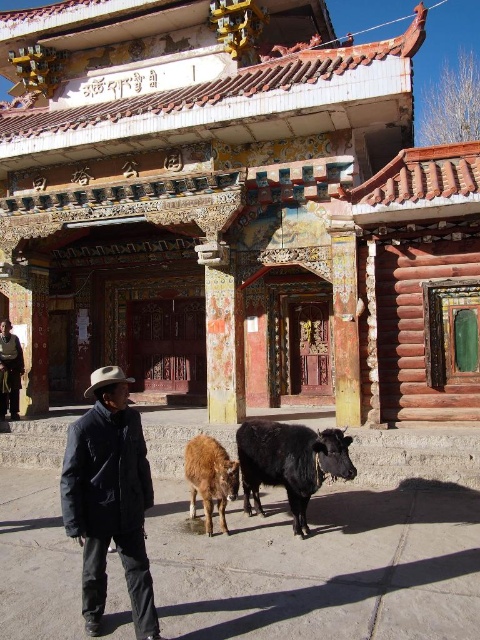
Can you confirm if dark brown leather jacket at left is bigger than white felt cowboy hat at center?

No.

Is dark brown leather jacket at left further to camera compared to white felt cowboy hat at center?

That is True.

The height and width of the screenshot is (640, 480). I want to click on dark brown leather jacket at left, so click(x=10, y=371).

Where is `black glossy bull at lower center`? The image size is (480, 640). black glossy bull at lower center is located at coordinates pos(289,461).

Can you confirm if dark blue puffy jacket at center is bigger than dark brown leather jacket at left?

Correct, dark blue puffy jacket at center is larger in size than dark brown leather jacket at left.

Who is positioned more to the left, dark blue puffy jacket at center or dark brown leather jacket at left?

dark brown leather jacket at left is more to the left.

Where is `dark blue puffy jacket at center`? dark blue puffy jacket at center is located at coordinates (109, 499).